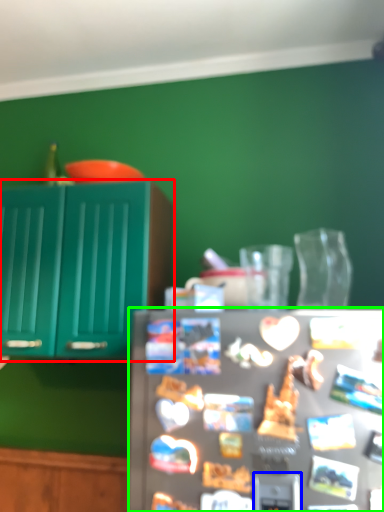
Question: Which object is the farthest from cabinetry (highlighted by a red box)? Choose among these: appliance (highlighted by a blue box) or refrigerator (highlighted by a green box).

Choices:
 (A) appliance
 (B) refrigerator

Answer: (A)